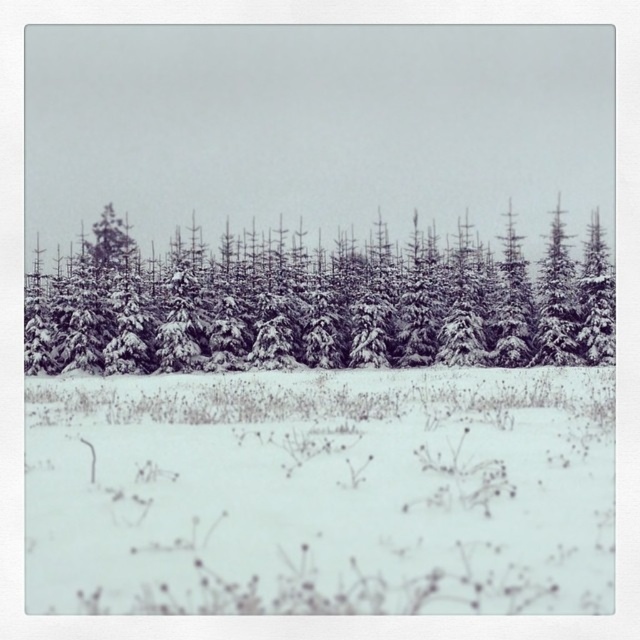
Does white fluffy snow at center come behind snow-covered evergreen trees at center?

No, it is not.

Is white fluffy snow at center above snow-covered evergreen trees at center?

Incorrect, white fluffy snow at center is not positioned above snow-covered evergreen trees at center.

Is point (124, 529) closer to camera compared to point (360, 269)?

Yes, point (124, 529) is in front of point (360, 269).

Locate an element on the screen. white fluffy snow at center is located at coordinates (321, 492).